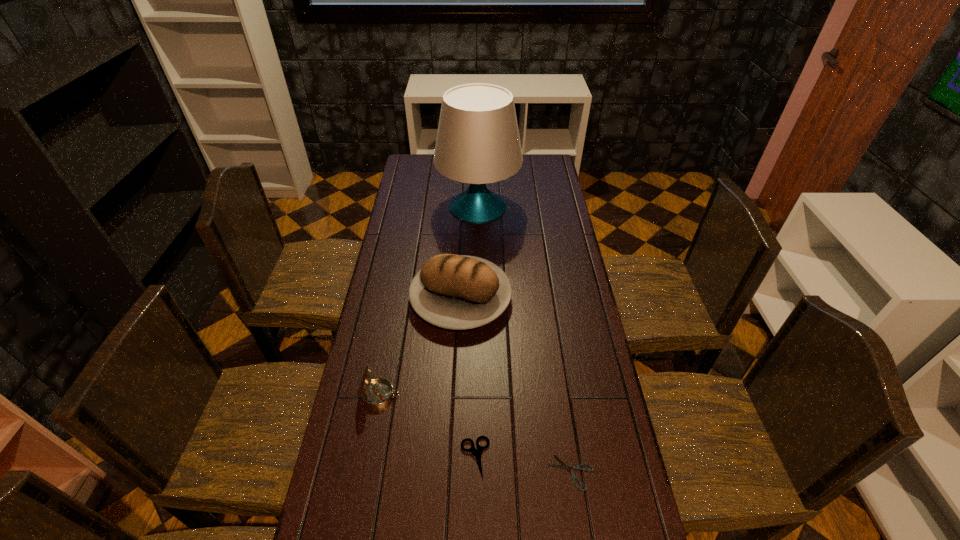
Find the location of a particular element. Image resolution: width=960 pixels, height=540 pixels. the farthest object is located at coordinates (478, 142).

Image resolution: width=960 pixels, height=540 pixels. Find the location of `the tallest object`. the tallest object is located at coordinates (478, 142).

This screenshot has height=540, width=960. In order to click on the second farthest object in this screenshot , I will do `click(458, 292)`.

Find the location of a particular element. The height and width of the screenshot is (540, 960). bread is located at coordinates (458, 292).

Locate an element on the screen. the third nearest object is located at coordinates (376, 393).

You are a GUI agent. You are given a task and a screenshot of the screen. Output one action in this format:
    pyautogui.click(x=<x>, y=<y>)
    Task: Click on the compass
    The image size is (960, 540).
    Given the screenshot: What is the action you would take?
    pyautogui.click(x=376, y=393)

Identify the location of the taller shears. (477, 453).

You are a GUI agent. You are given a task and a screenshot of the screen. Output one action in this format:
    pyautogui.click(x=<x>, y=<y>)
    Task: Click on the second shortest object
    
    Given the screenshot: What is the action you would take?
    pyautogui.click(x=477, y=453)

Where is `the shorter shears`? the shorter shears is located at coordinates (565, 466).

The width and height of the screenshot is (960, 540). I want to click on the shortest object, so click(x=565, y=466).